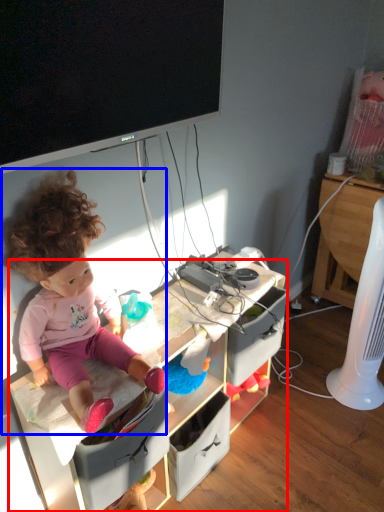
Question: Which object is further to the camera taking this photo, desk (highlighted by a red box) or person (highlighted by a blue box)?

Choices:
 (A) desk
 (B) person

Answer: (A)